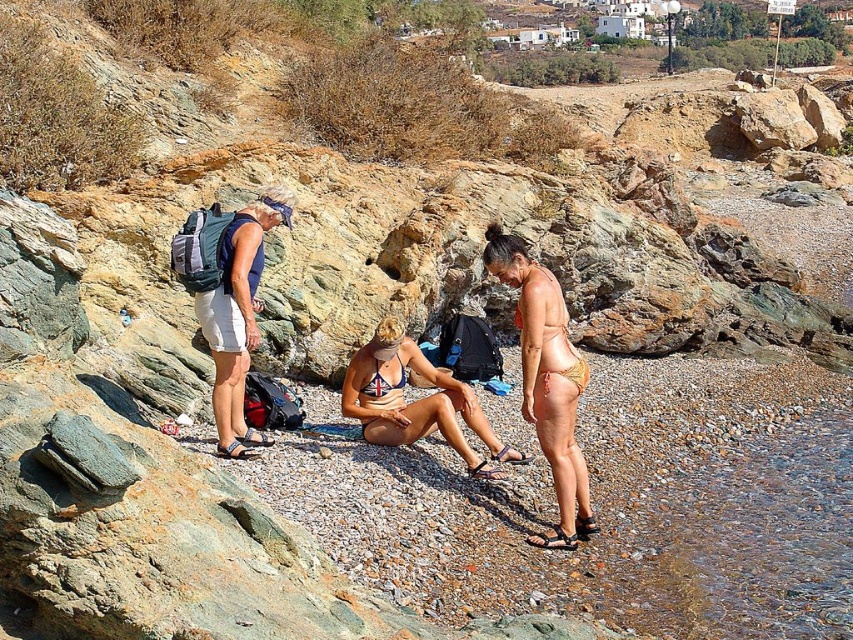
Does tan bikini at center appear over blue bikini at center?

Yes.

Who is shorter, tan bikini at center or blue bikini at center?

With less height is blue bikini at center.

Does point (531, 364) come in front of point (387, 417)?

Yes, it is.

The image size is (853, 640). Find the location of `tan bikini at center`. tan bikini at center is located at coordinates (546, 381).

Which is behind, point (393, 400) or point (380, 392)?

Point (393, 400)

Is point (370, 358) less distant than point (370, 388)?

No.

What are the coordinates of `blue bikini at center` in the screenshot? It's located at (415, 401).

Which is more to the right, matte blue tank top at center or blue bikini at center?

blue bikini at center is more to the right.

Can you confirm if matte blue tank top at center is wider than blue bikini at center?

Result: No.

Is point (224, 336) positioned after point (415, 432)?

That is False.

Find the location of `matte blue tank top at center`. matte blue tank top at center is located at coordinates (229, 301).